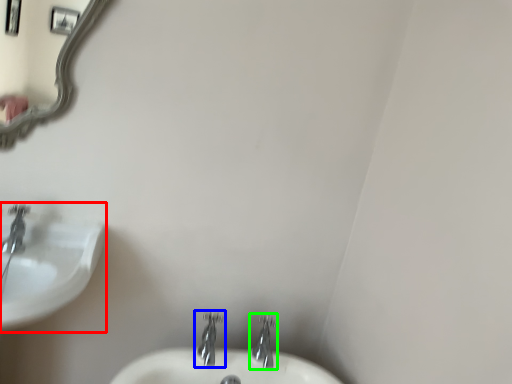
Question: Based on their relative distances, which object is farther from sink (highlighted by a red box)? Choose from tap (highlighted by a blue box) and tap (highlighted by a green box).

Choices:
 (A) tap
 (B) tap

Answer: (B)